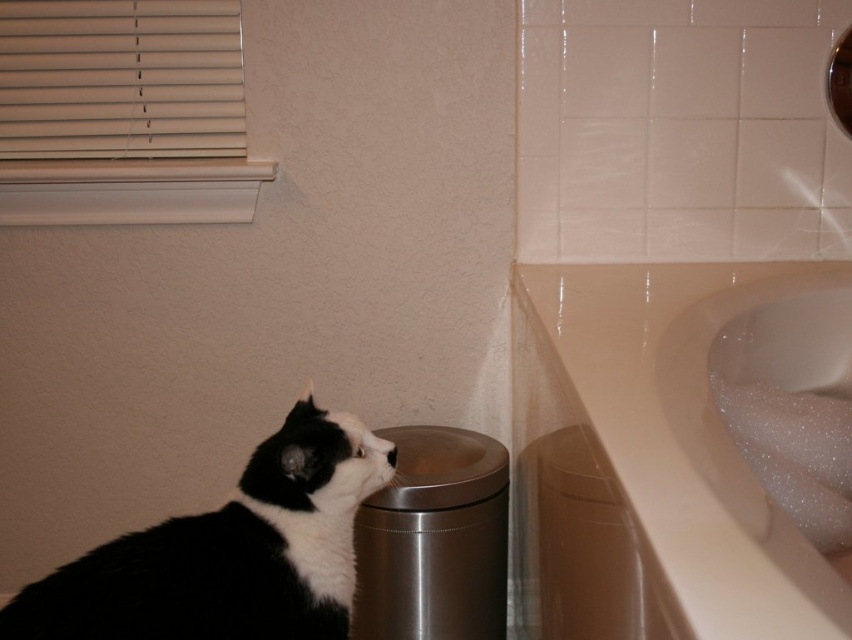
Question: Observing the image, what is the correct spatial positioning of white glossy sink at upper right in reference to black and white fur at lower left?

Choices:
 (A) left
 (B) right

Answer: (B)

Question: Which of the following is the farthest from the observer?

Choices:
 (A) (672, 316)
 (B) (95, 604)

Answer: (A)

Question: Where is white glossy sink at upper right located in relation to black and white fur at lower left in the image?

Choices:
 (A) above
 (B) below

Answer: (A)

Question: Is white glossy sink at upper right below black and white fur at lower left?

Choices:
 (A) yes
 (B) no

Answer: (B)